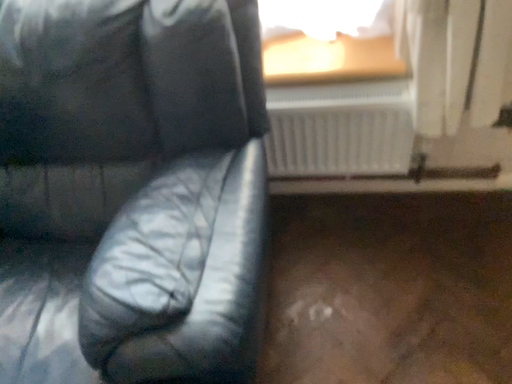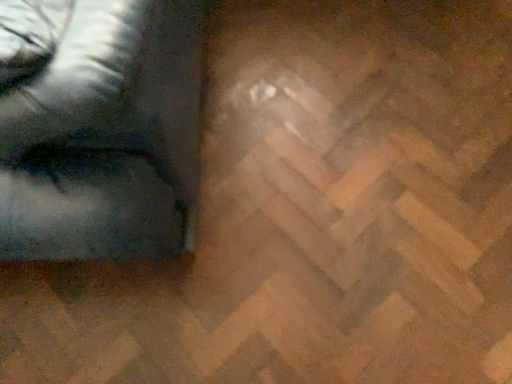
Question: Which way did the camera rotate in the video?

Choices:
 (A) rotated downward
 (B) rotated upward

Answer: (A)